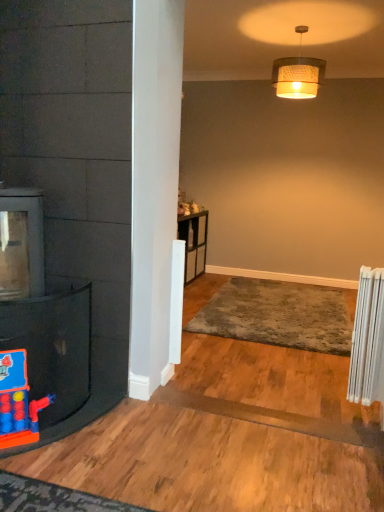
Question: Looking at the image, does white plastic radiator at right seem bigger or smaller compared to gray plush rug at center?

Choices:
 (A) small
 (B) big

Answer: (A)

Question: Considering their positions, is white plastic radiator at right located in front of or behind gray plush rug at center?

Choices:
 (A) behind
 (B) front

Answer: (B)

Question: Estimate the real-world distances between objects in this image. Which object is farther from the rubberized plastic toy at left?

Choices:
 (A) white plastic radiator at right
 (B) woven fabric lampshade at upper center
 (C) gray plush rug at center

Answer: (B)

Question: Considering the real-world distances, which object is closest to the rubberized plastic toy at left?

Choices:
 (A) woven fabric lampshade at upper center
 (B) white plastic radiator at right
 (C) gray plush rug at center

Answer: (B)